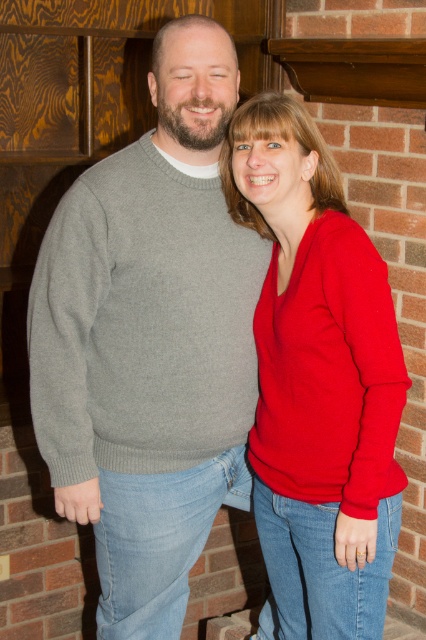
Does gray sweater at center have a greater height compared to red matte sweater at center?

Correct, gray sweater at center is much taller as red matte sweater at center.

Is point (55, 228) positioned after point (347, 538)?

Yes, point (55, 228) is behind point (347, 538).

Find the location of `gray sweater at center`. gray sweater at center is located at coordinates (149, 340).